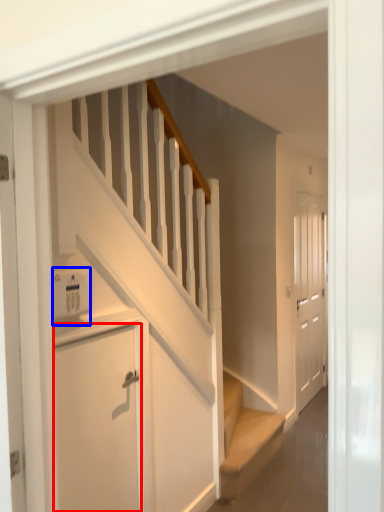
Question: Which object appears farthest to the camera in this image, door (highlighted by a red box) or appliance (highlighted by a blue box)?

Choices:
 (A) door
 (B) appliance

Answer: (A)